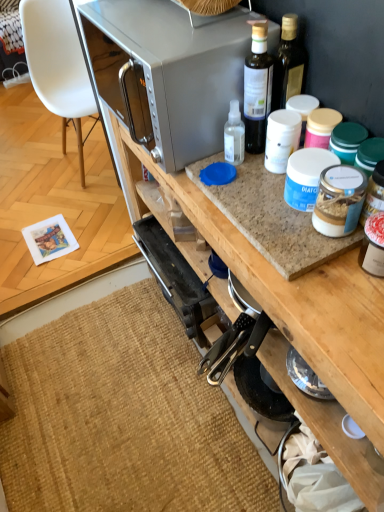
This screenshot has height=512, width=384. What are the coordinates of `burlap mat at lower left` in the screenshot? It's located at (123, 418).

Describe the element at coordinates (59, 67) in the screenshot. I see `white plastic chair at left` at that location.

Describe the element at coordinates (257, 89) in the screenshot. The width and height of the screenshot is (384, 512). I see `translucent plastic bottle at upper center` at that location.

What are the coordinates of `satin silver microwave at upper center` in the screenshot? It's located at (169, 72).

Is translucent plastic bottle at upper center outside of burlap mat at lower left?

Yes, translucent plastic bottle at upper center is located beyond the bounds of burlap mat at lower left.

Is translucent plastic bottle at upper center to the left or to the right of burlap mat at lower left in the image?

From the image, it's evident that translucent plastic bottle at upper center is to the right of burlap mat at lower left.

Consider the image. Looking at the image, does translucent plastic bottle at upper center seem bigger or smaller compared to burlap mat at lower left?

Considering their sizes, translucent plastic bottle at upper center takes up less space than burlap mat at lower left.

Is satin silver microwave at upper center inside or outside of burlap mat at lower left?

satin silver microwave at upper center is spatially situated outside burlap mat at lower left.

From the image's perspective, is satin silver microwave at upper center on burlap mat at lower left?

Indeed, from the image's perspective, satin silver microwave at upper center is shown above burlap mat at lower left.

Who is taller, satin silver microwave at upper center or burlap mat at lower left?

Standing taller between the two is satin silver microwave at upper center.

Does point (208, 445) lie in front of point (248, 141)?

That is False.

From the image's perspective, is burlap mat at lower left above or below translucent plastic bottle at upper center?

Based on their image positions, burlap mat at lower left is located beneath translucent plastic bottle at upper center.

Is burlap mat at lower left completely or partially outside of translucent plastic bottle at upper center?

Yes, burlap mat at lower left is outside of translucent plastic bottle at upper center.

From the image's perspective, is translucent plastic bottle at upper center on satin silver microwave at upper center?

Incorrect, from the image's perspective, translucent plastic bottle at upper center is lower than satin silver microwave at upper center.

Are translucent plastic bottle at upper center and satin silver microwave at upper center located far from each other?

No, translucent plastic bottle at upper center is not far from satin silver microwave at upper center.

Is translucent plastic bottle at upper center outside of satin silver microwave at upper center?

Indeed, translucent plastic bottle at upper center is completely outside satin silver microwave at upper center.

Locate an element on the screen. This screenshot has height=512, width=384. bottle below the satin silver microwave at upper center (from the image's perspective) is located at coordinates (257, 89).

Locate an element on the screen. Image resolution: width=384 pixels, height=512 pixels. chair behind the burlap mat at lower left is located at coordinates (59, 67).

Considering the sizes of objects white plastic chair at left and burlap mat at lower left in the image provided, who is smaller, white plastic chair at left or burlap mat at lower left?

burlap mat at lower left is smaller.

How far apart are white plastic chair at left and burlap mat at lower left?

white plastic chair at left is 1.35 meters from burlap mat at lower left.

Can you confirm if white plastic chair at left is taller than burlap mat at lower left?

Yes, white plastic chair at left is taller than burlap mat at lower left.

Is satin silver microwave at upper center turned away from translucent plastic bottle at upper center?

No, satin silver microwave at upper center's orientation is not away from translucent plastic bottle at upper center.

Who is more distant, satin silver microwave at upper center or translucent plastic bottle at upper center?

Positioned behind is satin silver microwave at upper center.

Is satin silver microwave at upper center to the right of translucent plastic bottle at upper center from the viewer's perspective?

In fact, satin silver microwave at upper center is to the left of translucent plastic bottle at upper center.

Find the location of a particular element. bottle on the right of satin silver microwave at upper center is located at coordinates [257, 89].

Considering the relative positions of translucent plastic bottle at upper center and white plastic chair at left in the image provided, is translucent plastic bottle at upper center to the left of white plastic chair at left from the viewer's perspective?

In fact, translucent plastic bottle at upper center is to the right of white plastic chair at left.

In terms of width, does translucent plastic bottle at upper center look wider or thinner when compared to white plastic chair at left?

Considering their sizes, translucent plastic bottle at upper center looks slimmer than white plastic chair at left.

Do you think translucent plastic bottle at upper center is within white plastic chair at left, or outside of it?

The correct answer is: outside.

What's the angular difference between translucent plastic bottle at upper center and white plastic chair at left's facing directions?

93.5 degrees.

Image resolution: width=384 pixels, height=512 pixels. In order to click on mat that is on the left side of translucent plastic bottle at upper center in this screenshot , I will do `click(123, 418)`.

Image resolution: width=384 pixels, height=512 pixels. What are the coordinates of `microwave oven on the right of burlap mat at lower left` in the screenshot? It's located at (169, 72).

From the image, which object appears to be farther from translucent plastic bottle at upper center, white plastic chair at left or satin silver microwave at upper center?

white plastic chair at left lies further to translucent plastic bottle at upper center than the other object.

Looking at the image, which one is located closer to satin silver microwave at upper center, white plastic chair at left or translucent plastic bottle at upper center?

The object closer to satin silver microwave at upper center is translucent plastic bottle at upper center.

Looking at the image, which one is located closer to white plastic chair at left, translucent plastic bottle at upper center or satin silver microwave at upper center?

Based on the image, satin silver microwave at upper center appears to be nearer to white plastic chair at left.

Estimate the real-world distances between objects in this image. Which object is closer to white plastic chair at left, satin silver microwave at upper center or burlap mat at lower left?

Among the two, satin silver microwave at upper center is located nearer to white plastic chair at left.

Based on their spatial positions, is burlap mat at lower left or translucent plastic bottle at upper center closer to white plastic chair at left?

Based on the image, burlap mat at lower left appears to be nearer to white plastic chair at left.

From the picture: From the image, which object appears to be nearer to satin silver microwave at upper center, burlap mat at lower left or translucent plastic bottle at upper center?

translucent plastic bottle at upper center lies closer to satin silver microwave at upper center than the other object.

Estimate the real-world distances between objects in this image. Which object is further from burlap mat at lower left, translucent plastic bottle at upper center or white plastic chair at left?

white plastic chair at left lies further to burlap mat at lower left than the other object.

From the image, which object appears to be farther from burlap mat at lower left, white plastic chair at left or translucent plastic bottle at upper center?

The object further to burlap mat at lower left is white plastic chair at left.

The width and height of the screenshot is (384, 512). I want to click on microwave oven between white plastic chair at left and burlap mat at lower left from top to bottom, so click(x=169, y=72).

The image size is (384, 512). I want to click on bottle between satin silver microwave at upper center and burlap mat at lower left vertically, so click(x=257, y=89).

You are a GUI agent. You are given a task and a screenshot of the screen. Output one action in this format:
    pyautogui.click(x=<x>, y=<y>)
    Task: Click on the bottle between white plastic chair at left and burlap mat at lower left vertically
    Image resolution: width=384 pixels, height=512 pixels.
    Given the screenshot: What is the action you would take?
    pyautogui.click(x=257, y=89)

You are a GUI agent. You are given a task and a screenshot of the screen. Output one action in this format:
    pyautogui.click(x=<x>, y=<y>)
    Task: Click on the microwave oven located between translucent plastic bottle at upper center and white plastic chair at left in the depth direction
    This screenshot has height=512, width=384.
    Given the screenshot: What is the action you would take?
    pyautogui.click(x=169, y=72)